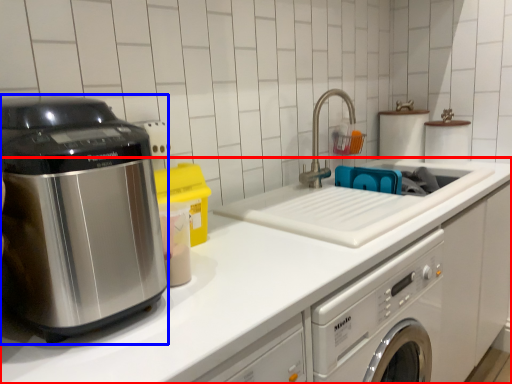
Question: Among these objects, which one is nearest to the camera, countertop (highlighted by a red box) or home appliance (highlighted by a blue box)?

Choices:
 (A) countertop
 (B) home appliance

Answer: (B)